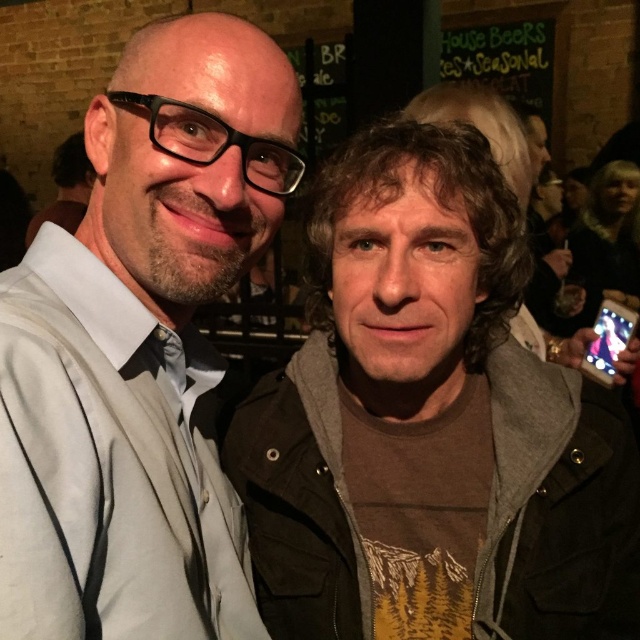
Does brown cotton shirt at center come in front of matte black jacket at left?

No, it is not.

Between point (481, 220) and point (104, 625), which one is positioned behind?

The point (481, 220) is behind.

Where is `brown cotton shirt at center`? This screenshot has height=640, width=640. brown cotton shirt at center is located at coordinates (428, 410).